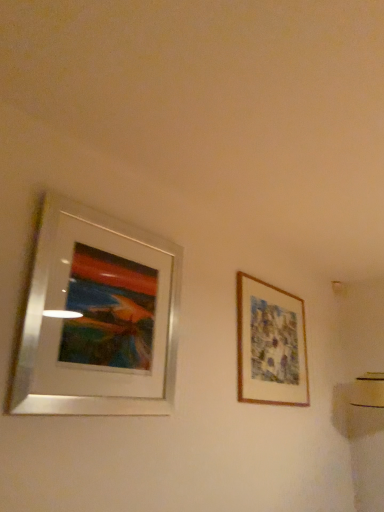
Question: Is wooden framed artwork at right, acting as the 1th picture frame starting from the back, taller or shorter than silver metallic picture frame at left, positioned as the second picture frame in right-to-left order?

Choices:
 (A) short
 (B) tall

Answer: (A)

Question: From a real-world perspective, is wooden framed artwork at right, arranged as the second picture frame when viewed from the left, physically located above or below silver metallic picture frame at left, positioned as the second picture frame in right-to-left order?

Choices:
 (A) below
 (B) above

Answer: (B)

Question: Considering the positions of point pos(244,330) and point pos(150,261), is point pos(244,330) closer or farther from the camera than point pos(150,261)?

Choices:
 (A) closer
 (B) farther

Answer: (B)

Question: From a real-world perspective, is silver metallic picture frame at left, acting as the second picture frame starting from the back, above or below wooden framed artwork at right, which appears as the first picture frame when viewed from the right?

Choices:
 (A) above
 (B) below

Answer: (B)

Question: In terms of width, does silver metallic picture frame at left, positioned as the second picture frame in right-to-left order, look wider or thinner when compared to wooden framed artwork at right, acting as the 1th picture frame starting from the back?

Choices:
 (A) wide
 (B) thin

Answer: (A)

Question: From the image's perspective, relative to wooden framed artwork at right, arranged as the second picture frame when viewed from the left, is silver metallic picture frame at left, positioned as the second picture frame in right-to-left order, above or below?

Choices:
 (A) below
 (B) above

Answer: (B)

Question: Considering their positions, is silver metallic picture frame at left, acting as the second picture frame starting from the back, located in front of or behind wooden framed artwork at right, arranged as the second picture frame when viewed from the left?

Choices:
 (A) behind
 (B) front

Answer: (B)